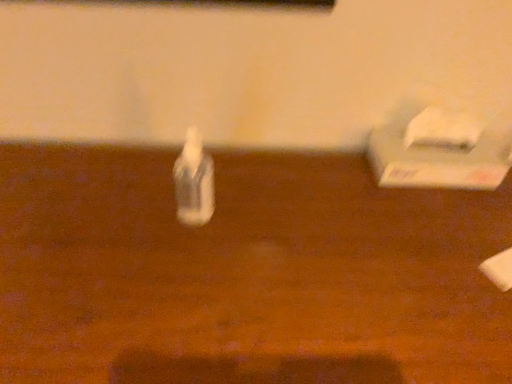
Question: From the image's perspective, relative to white matte tissue box at right, is wooden table at center above or below?

Choices:
 (A) below
 (B) above

Answer: (A)

Question: Is wooden table at center taller or shorter than white matte tissue box at right?

Choices:
 (A) short
 (B) tall

Answer: (B)

Question: Estimate the real-world distances between objects in this image. Which object is closer to the white matte tissue box at right?

Choices:
 (A) wooden table at center
 (B) transparent plastic bottle at center

Answer: (A)

Question: Which is farther from the white matte tissue box at right?

Choices:
 (A) transparent plastic bottle at center
 (B) wooden table at center

Answer: (A)